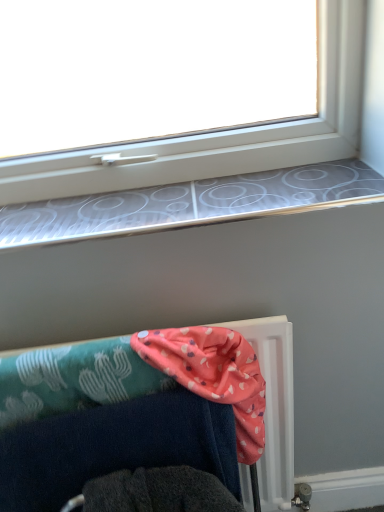
Where is `silver metallic window sill at upper center`? The height and width of the screenshot is (512, 384). silver metallic window sill at upper center is located at coordinates (190, 203).

This screenshot has width=384, height=512. Describe the element at coordinates (274, 406) in the screenshot. I see `pink fabric at lower right` at that location.

Measure the distance between point (249, 409) and camera.

A distance of 34.53 inches exists between point (249, 409) and camera.

The width and height of the screenshot is (384, 512). In order to click on silver metallic window sill at upper center in this screenshot , I will do `click(190, 203)`.

Based on the photo, is pink fabric at lower center at the right side of pink fabric at lower right?

Yes.

Is pink fabric at lower center not close to pink fabric at lower right?

No, pink fabric at lower center is not far away from pink fabric at lower right.

How many degrees apart are the facing directions of pink fabric at lower center and pink fabric at lower right?

They differ by 0.118 degrees in their facing directions.

Is pink fabric at lower center located outside pink fabric at lower right?

No.

Relative to silver metallic window sill at upper center, is pink fabric at lower right in front or behind?

Visually, pink fabric at lower right is located in front of silver metallic window sill at upper center.

Which is more to the right, pink fabric at lower right or silver metallic window sill at upper center?

From the viewer's perspective, silver metallic window sill at upper center appears more on the right side.

Does pink fabric at lower right have a larger size compared to silver metallic window sill at upper center?

Correct, pink fabric at lower right is larger in size than silver metallic window sill at upper center.

Consider the image. From a real-world perspective, is pink fabric at lower right physically below pink fabric at lower center?

Yes, from a real-world perspective, pink fabric at lower right is beneath pink fabric at lower center.

Which is further, (285, 447) or (202, 372)?

The point (285, 447) is behind.

Is pink fabric at lower right placed right next to pink fabric at lower center?

pink fabric at lower right is not next to pink fabric at lower center, and they're not touching.

Between pink fabric at lower right and pink fabric at lower center, which one appears on the left side from the viewer's perspective?

Positioned to the left is pink fabric at lower right.

Who is bigger, silver metallic window sill at upper center or pink fabric at lower center?

Bigger between the two is pink fabric at lower center.

Does silver metallic window sill at upper center have a greater width compared to pink fabric at lower center?

Indeed, silver metallic window sill at upper center has a greater width compared to pink fabric at lower center.

Where is `scarf that is below the silver metallic window sill at upper center (from the image's perspective)`? scarf that is below the silver metallic window sill at upper center (from the image's perspective) is located at coordinates point(213,375).

Is silver metallic window sill at upper center positioned far away from pink fabric at lower center?

Actually, silver metallic window sill at upper center and pink fabric at lower center are a little close together.

Does silver metallic window sill at upper center appear on the right side of pink fabric at lower right?

Yes.

From the image's perspective, between silver metallic window sill at upper center and pink fabric at lower right, which one is located above?

From the image's view, silver metallic window sill at upper center is above.

Can you tell me how much silver metallic window sill at upper center and pink fabric at lower right differ in facing direction?

They differ by 2 degrees in their facing directions.

The width and height of the screenshot is (384, 512). What are the coordinates of `window sill that is on the right side of pink fabric at lower right` in the screenshot? It's located at (190, 203).

Is pink fabric at lower center next to silver metallic window sill at upper center and touching it?

No, pink fabric at lower center is not touching silver metallic window sill at upper center.

Which of these two, pink fabric at lower center or silver metallic window sill at upper center, is smaller?

silver metallic window sill at upper center.

Does pink fabric at lower center have a lesser height compared to silver metallic window sill at upper center?

No.

Locate an element on the screen. furniture located below the pink fabric at lower center (from the image's perspective) is located at coordinates (274, 406).

You are a GUI agent. You are given a task and a screenshot of the screen. Output one action in this format:
    pyautogui.click(x=<x>, y=<y>)
    Task: Click on the window sill that appears on the right of pink fabric at lower right
    
    Given the screenshot: What is the action you would take?
    pyautogui.click(x=190, y=203)

Based on their spatial positions, is silver metallic window sill at upper center or pink fabric at lower right closer to pink fabric at lower center?

pink fabric at lower right lies closer to pink fabric at lower center than the other object.

Estimate the real-world distances between objects in this image. Which object is closer to pink fabric at lower right, silver metallic window sill at upper center or pink fabric at lower center?

pink fabric at lower center is positioned closer to the anchor pink fabric at lower right.

Estimate the real-world distances between objects in this image. Which object is further from silver metallic window sill at upper center, pink fabric at lower right or pink fabric at lower center?

Among the two, pink fabric at lower right is located further to silver metallic window sill at upper center.

Considering their positions, is pink fabric at lower right positioned further to pink fabric at lower center than silver metallic window sill at upper center?

Based on the image, silver metallic window sill at upper center appears to be further to pink fabric at lower center.

Which object lies nearer to the anchor point silver metallic window sill at upper center, pink fabric at lower center or pink fabric at lower right?

The object closer to silver metallic window sill at upper center is pink fabric at lower center.

From the image, which object appears to be farther from pink fabric at lower right, pink fabric at lower center or silver metallic window sill at upper center?

The object further to pink fabric at lower right is silver metallic window sill at upper center.

The height and width of the screenshot is (512, 384). Find the location of `scarf between silver metallic window sill at upper center and pink fabric at lower right from top to bottom`. scarf between silver metallic window sill at upper center and pink fabric at lower right from top to bottom is located at coordinates (213, 375).